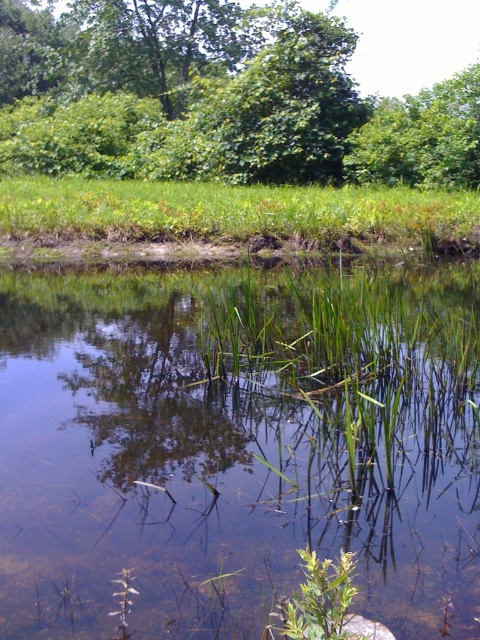
Can you confirm if green leafy tree at upper center is wider than green grass at center?

Correct, the width of green leafy tree at upper center exceeds that of green grass at center.

Between green leafy tree at upper center and green grass at center, which one is positioned lower?

green grass at center

This screenshot has height=640, width=480. What are the coordinates of `green leafy tree at upper center` in the screenshot? It's located at (232, 93).

This screenshot has height=640, width=480. What are the coordinates of `green leafy tree at upper center` in the screenshot? It's located at (232, 93).

Can you confirm if clear water at center is wider than green leafy tree at upper center?

No.

Who is more distant from viewer, (x=399, y=308) or (x=96, y=33)?

The point (x=96, y=33) is more distant.

What do you see at coordinates (237, 449) in the screenshot?
I see `clear water at center` at bounding box center [237, 449].

Where is `clear water at center`? clear water at center is located at coordinates (237, 449).

Can you confirm if clear water at center is positioned to the right of green grass at center?

Indeed, clear water at center is positioned on the right side of green grass at center.

Does point (392, 305) come in front of point (372, 220)?

That is True.

Locate an element on the screen. clear water at center is located at coordinates (237, 449).

The height and width of the screenshot is (640, 480). In order to click on clear water at center in this screenshot , I will do `click(237, 449)`.